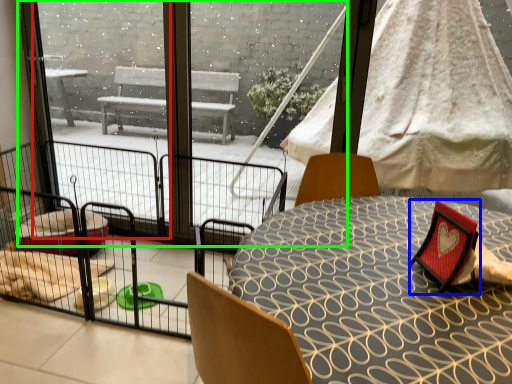
Question: Estimate the real-world distances between objects in this image. Which object is farther from window screen (highlighted by a red box), armchair (highlighted by a blue box) or glass door (highlighted by a green box)?

Choices:
 (A) armchair
 (B) glass door

Answer: (A)